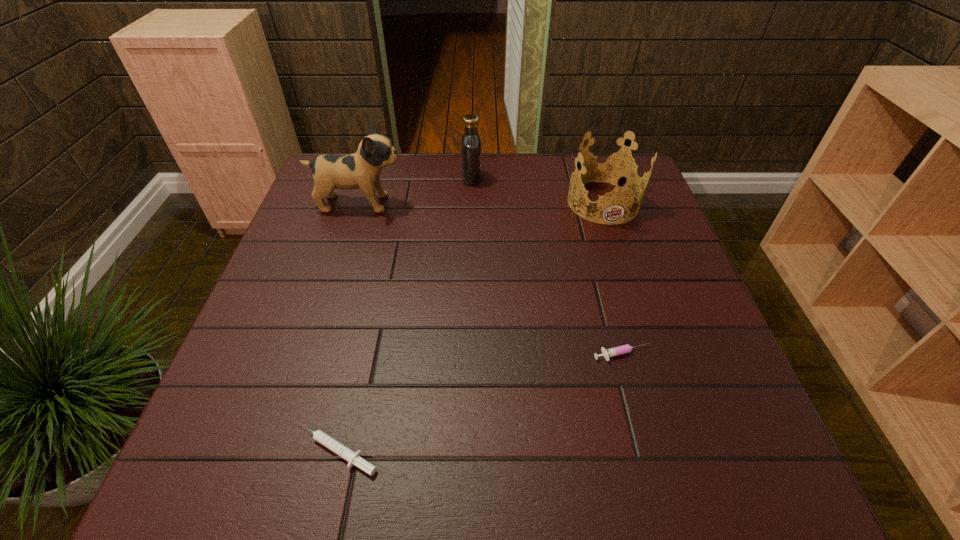
Locate an element on the screen. This screenshot has width=960, height=540. the tallest object is located at coordinates (362, 169).

This screenshot has width=960, height=540. I want to click on vodka, so [x=471, y=142].

At what (x,y) coordinates should I click in order to perform the action: click on crown. Please return your answer as a coordinate pair (x, y). This screenshot has height=540, width=960. Looking at the image, I should click on (612, 167).

Where is `the second nearest object`? The height and width of the screenshot is (540, 960). the second nearest object is located at coordinates (623, 349).

You are a GUI agent. You are given a task and a screenshot of the screen. Output one action in this format:
    pyautogui.click(x=<x>, y=<y>)
    Task: Click on the farther syringe
    
    Given the screenshot: What is the action you would take?
    pyautogui.click(x=623, y=349)

Where is `the nearer syringe`? Image resolution: width=960 pixels, height=540 pixels. the nearer syringe is located at coordinates (353, 458).

The width and height of the screenshot is (960, 540). Identify the location of the nearest object. (353, 458).

The image size is (960, 540). Identify the location of vacant space located 0.280m at the face of the puppy. point(505,204).

This screenshot has width=960, height=540. What are the coordinates of `vacant space located on the front-facing side of the third object from left to right` in the screenshot? It's located at (567, 178).

In order to click on vacant region located on the front of the crown in this screenshot , I will do `click(626, 273)`.